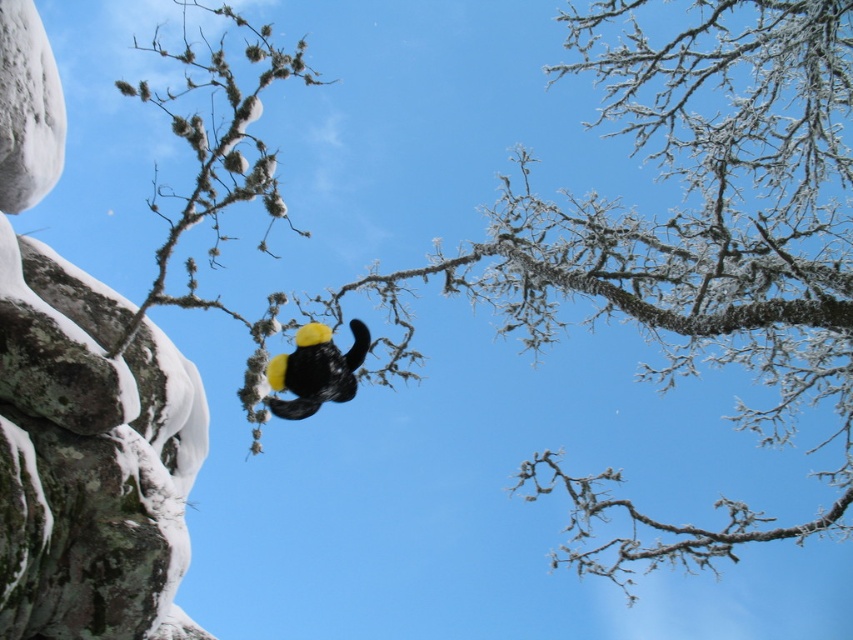
Question: Can you confirm if frosted branches at center is bigger than yellow matte hat at center?

Choices:
 (A) no
 (B) yes

Answer: (B)

Question: Is frosted branches at center below yellow matte hat at center?

Choices:
 (A) yes
 (B) no

Answer: (B)

Question: Which object is closer to the camera taking this photo?

Choices:
 (A) frosted branches at center
 (B) yellow matte hat at center

Answer: (A)

Question: Does frosted branches at center have a smaller size compared to yellow matte hat at center?

Choices:
 (A) yes
 (B) no

Answer: (B)